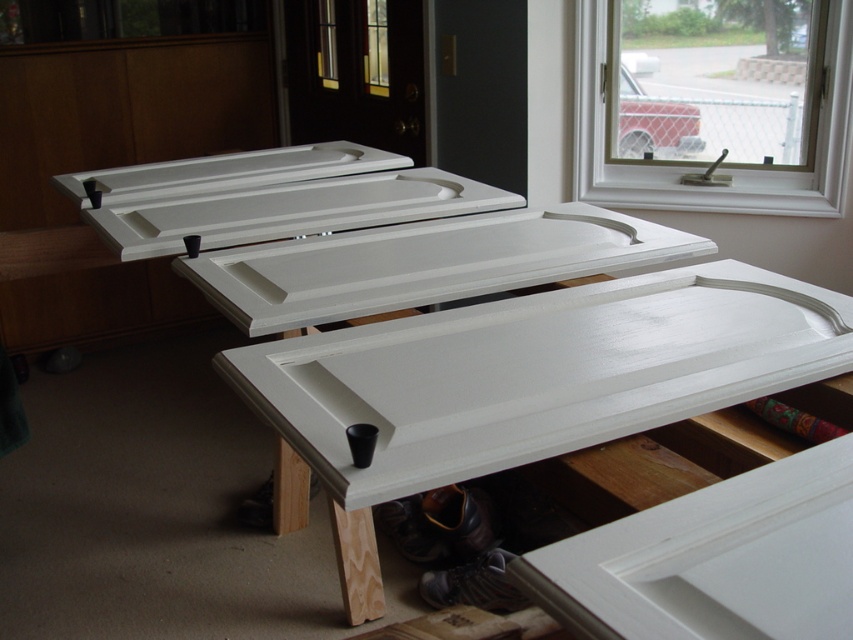
Based on the photo, between white painted wood door at center and white plastic window at upper right, which one appears on the right side from the viewer's perspective?

white plastic window at upper right is more to the right.

Does point (386, 465) come farther from viewer compared to point (816, 29)?

No, (386, 465) is closer to viewer.

Image resolution: width=853 pixels, height=640 pixels. Find the location of `white painted wood door at center`. white painted wood door at center is located at coordinates (529, 381).